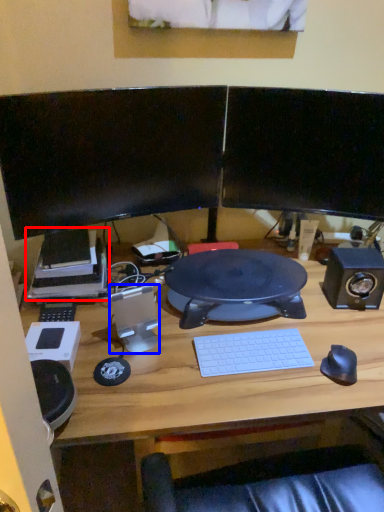
Question: Which of the following is the closest to the observer, printer (highlighted by a red box) or speaker (highlighted by a blue box)?

Choices:
 (A) printer
 (B) speaker

Answer: (B)